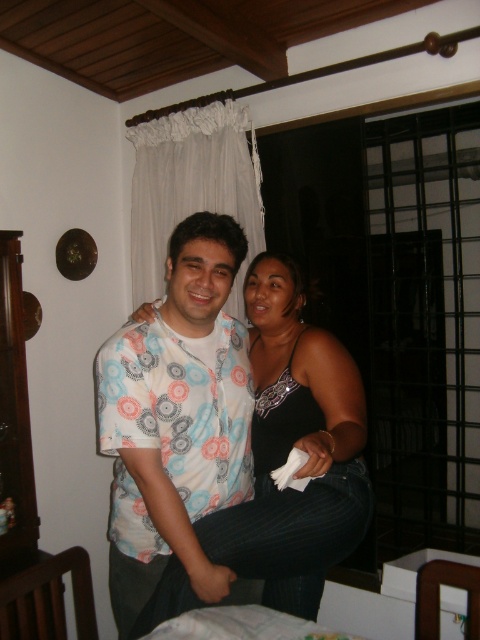
Can you confirm if white printed shirt at center is bigger than black satin tank top at center?

Incorrect, white printed shirt at center is not larger than black satin tank top at center.

Identify the location of white printed shirt at center. (177, 419).